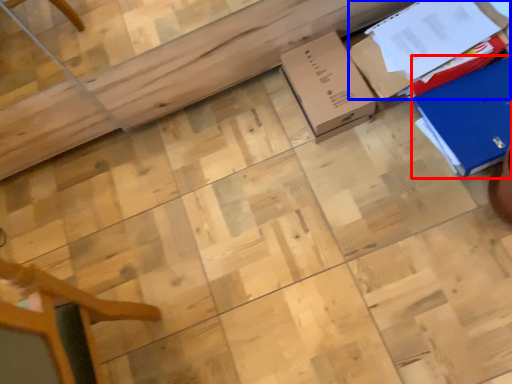
Question: Which object is closer to the camera taking this photo, cardboard box (highlighted by a red box) or cardboard box (highlighted by a blue box)?

Choices:
 (A) cardboard box
 (B) cardboard box

Answer: (A)